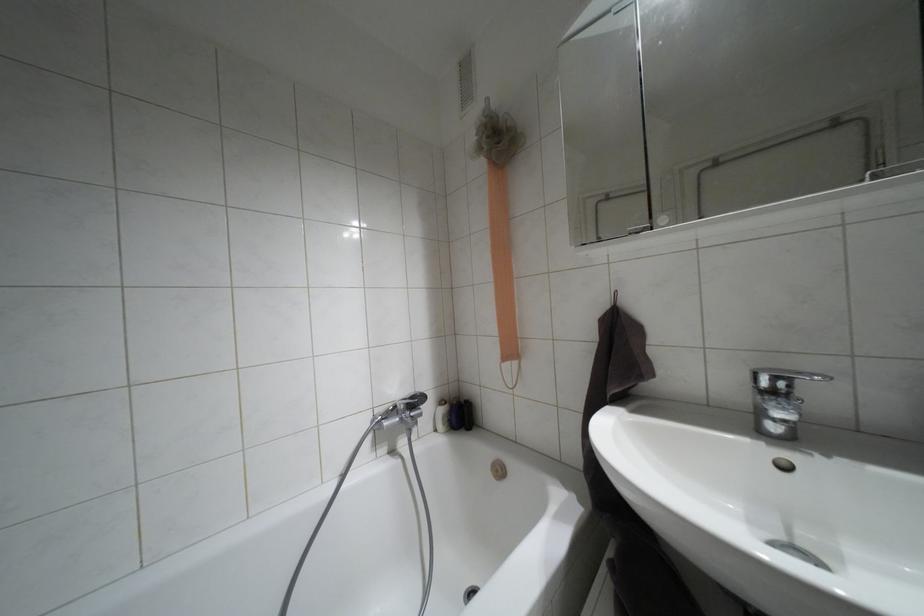
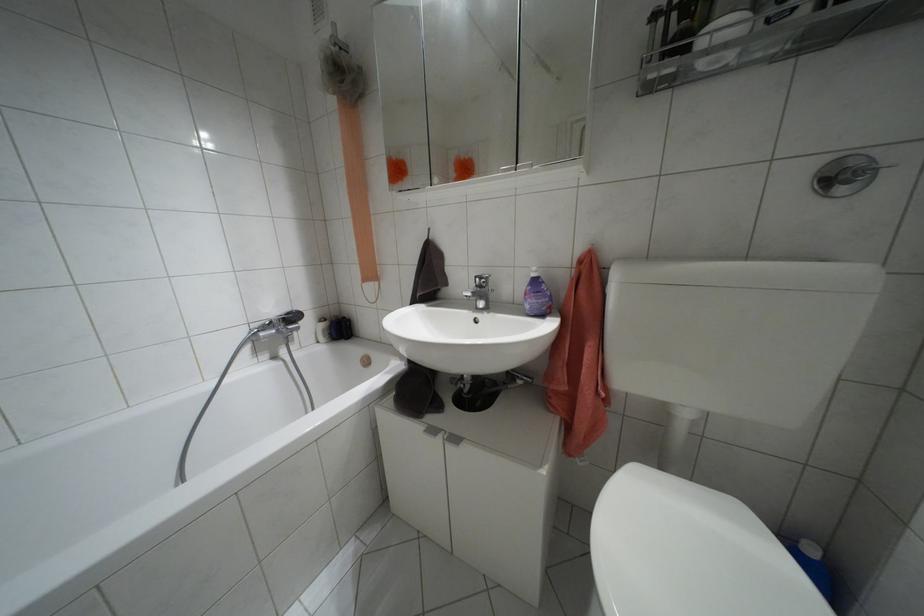
The point at (x=410, y=397) is marked in the first image. Where is the corresponding point in the second image?

(286, 313)